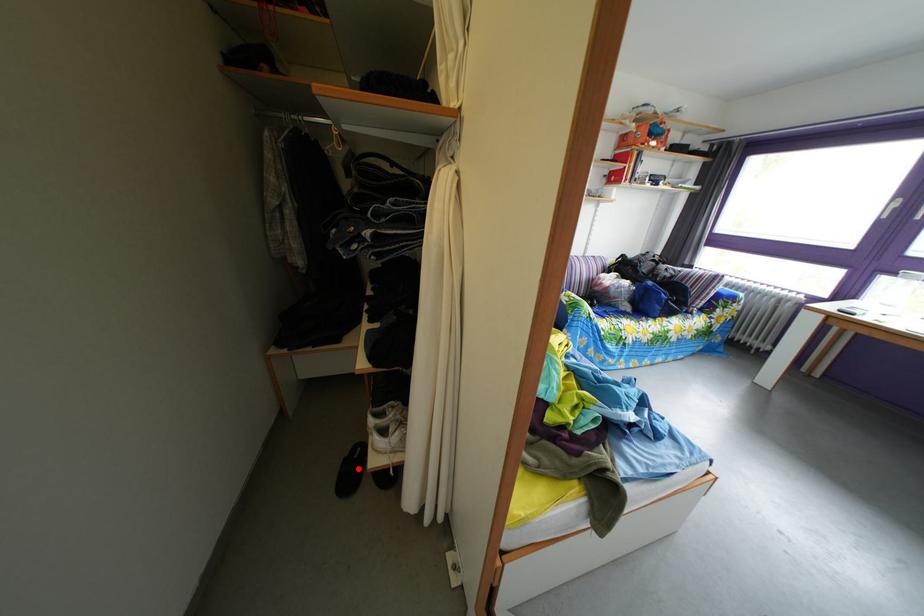
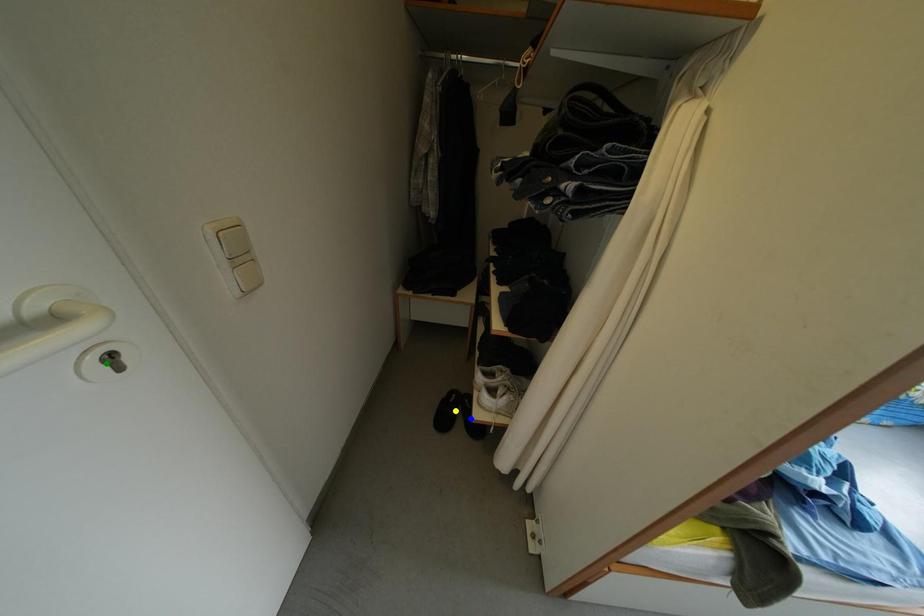
Question: I am providing you with two images of the same scene from different viewpoints. A red point is marked on the first image. You are given multiple points on the second image. In image 2, which mark is for the same physical point as the one in image 1?

Choices:
 (A) yellow point
 (B) blue point
 (C) green point

Answer: (A)